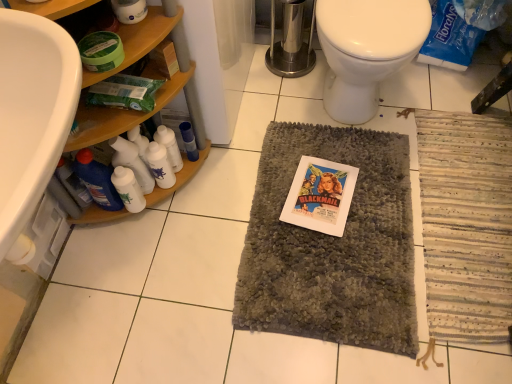
Where is `vacant space in between blue plastic bottle at center, which is the 5th bottle from left to right, and gray shaggy mat at center`? The height and width of the screenshot is (384, 512). vacant space in between blue plastic bottle at center, which is the 5th bottle from left to right, and gray shaggy mat at center is located at coordinates (228, 198).